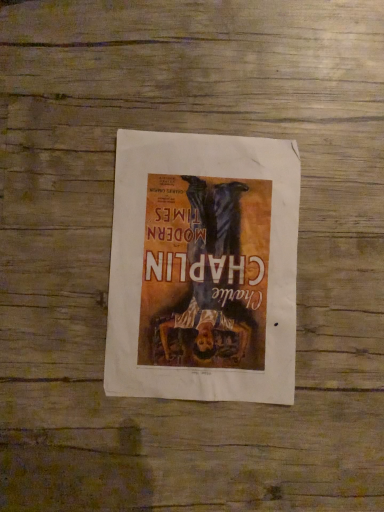
At what (x,y) coordinates should I click in order to perform the action: click on free location above matte paper poster at center (from a real-world perspective). Please return your answer as a coordinate pair (x, y). This screenshot has width=384, height=512. Looking at the image, I should click on (205, 262).